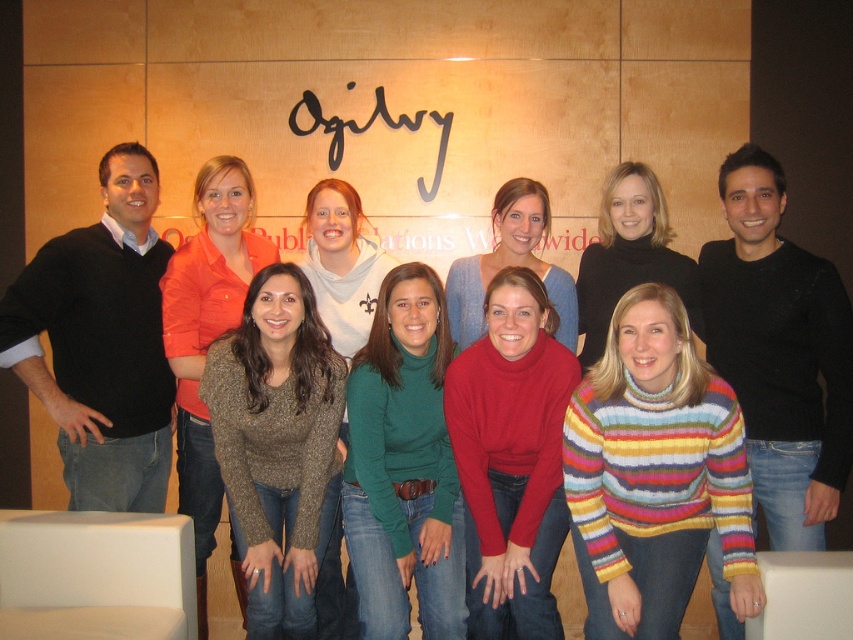
You are a photographer who wants to ensure that the matte orange shirt at center and the striped sweater at center are both visible in the final photo. Given their heights, which one might need to be adjusted to avoid being obscured?

The striped sweater at center has a smaller height compared to the matte orange shirt at center, so it might need to be raised or moved to ensure visibility.

You are a photographer who needs to adjust the lighting to ensure both the multicolored knitted sweater at center and the sparkly gold sweater at center are equally visible. Considering their positions, which sweater should you focus the light on first?

The multicolored knitted sweater at center is closer to the viewer than the sparkly gold sweater at center, so you should focus the light on the sparkly gold sweater at center first to ensure it receives adequate illumination.

You are a photographer who needs to adjust the lighting for a group photo. You notice two sweaters in the center of the image, a multicolored knitted sweater at center and a matte red sweater at center. Which sweater should you position closer to the light source to ensure it stands out more in the photo?

The multicolored knitted sweater at center is to the right of the matte red sweater at center. Since the multicolored sweater is positioned to the right, you should move it closer to the light source to ensure it stands out more in the photo.